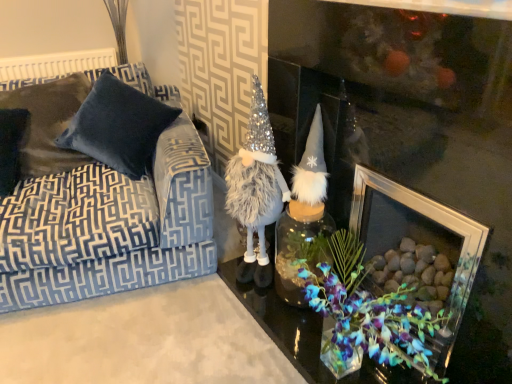
In order to click on vacant area to the left of clear glass picture frame at center in this screenshot , I will do `click(216, 337)`.